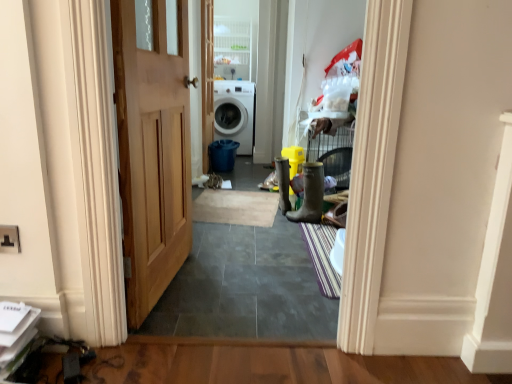
I want to click on free space in front of beige carpet at center, the second doormat positioned from the bottom, so click(x=242, y=241).